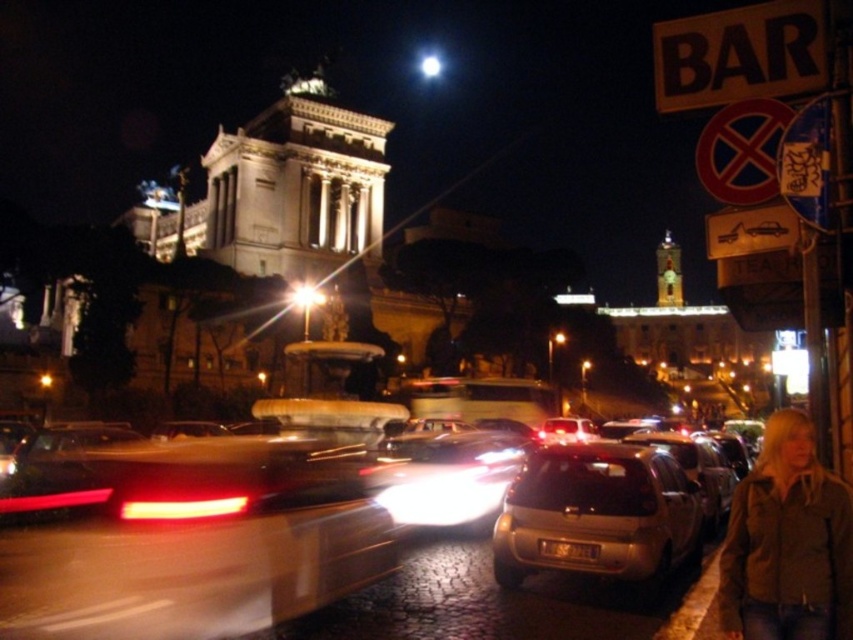
Does brown leather jacket at lower right come in front of metallic silver car at center?

That is True.

This screenshot has width=853, height=640. Find the location of `brown leather jacket at lower right`. brown leather jacket at lower right is located at coordinates (787, 544).

Locate an element on the screen. brown leather jacket at lower right is located at coordinates (787, 544).

The image size is (853, 640). What do you see at coordinates (598, 515) in the screenshot?
I see `satin gold car at lower right` at bounding box center [598, 515].

Is satin gold car at lower right shorter than black plastic sign at upper right?

No, satin gold car at lower right is not shorter than black plastic sign at upper right.

I want to click on satin gold car at lower right, so click(x=598, y=515).

Which is below, satin gold car at lower right or metallic silver car at center?

Positioned lower is satin gold car at lower right.

Is satin gold car at lower right to the right of metallic silver car at center from the viewer's perspective?

Indeed, satin gold car at lower right is positioned on the right side of metallic silver car at center.

Image resolution: width=853 pixels, height=640 pixels. What do you see at coordinates (598, 515) in the screenshot?
I see `satin gold car at lower right` at bounding box center [598, 515].

Identify the location of satin gold car at lower right. (598, 515).